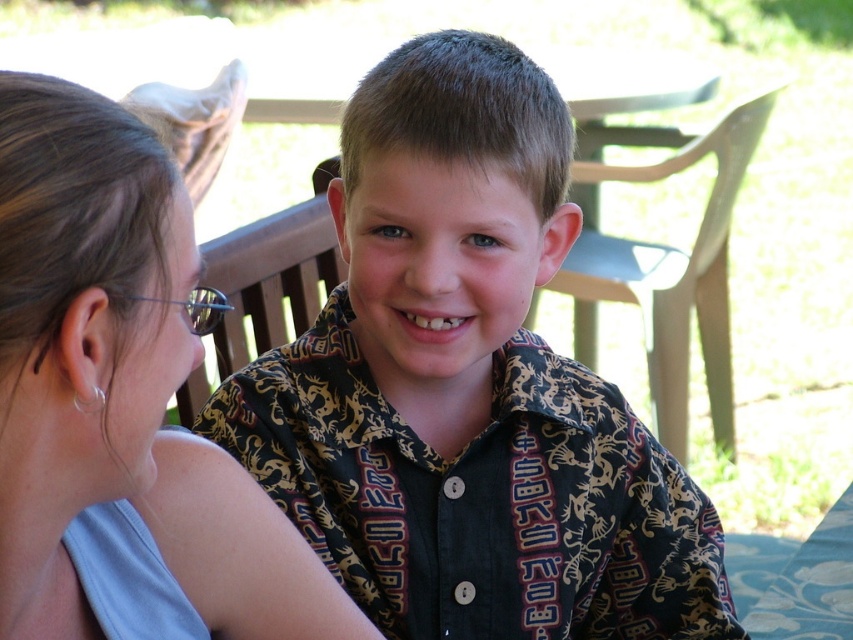
Looking at the scene, where is the printed fabric shirt at center in relation to the matte gray hair at upper left?

The printed fabric shirt at center is to the right of the matte gray hair at upper left.

You are a fashion designer observing the image. You need to determine if the printed fabric shirt at center can be seen without obstruction from the matte gray hair at upper left. Based on the scene description, can you confirm this?

The printed fabric shirt at center is positioned over matte gray hair at upper left, meaning it is visible without obstruction from the matte gray hair at upper left.